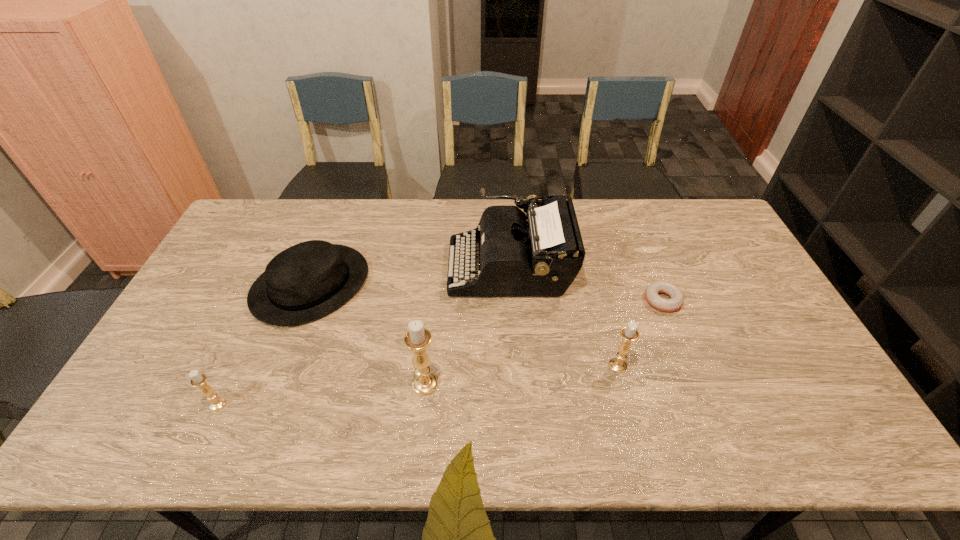
Locate an element on the screen. This screenshot has height=540, width=960. free location that satisfies the following two spatial constraints: 1. on the typing side of the fourth object from left to right; 2. on the front side of the shortest candle holder is located at coordinates (519, 404).

In order to click on vacant space that satisfies the following two spatial constraints: 1. on the typing side of the typewriter; 2. on the back side of the rightmost object in this screenshot , I will do `click(513, 300)`.

Image resolution: width=960 pixels, height=540 pixels. In order to click on vacant region that satisfies the following two spatial constraints: 1. on the typing side of the doughnut; 2. on the left side of the typewriter in this screenshot , I will do `click(513, 300)`.

Find the location of a particular element. The image size is (960, 540). free location that satisfies the following two spatial constraints: 1. on the back side of the shortest object; 2. on the typing side of the third object from right to left is located at coordinates (650, 267).